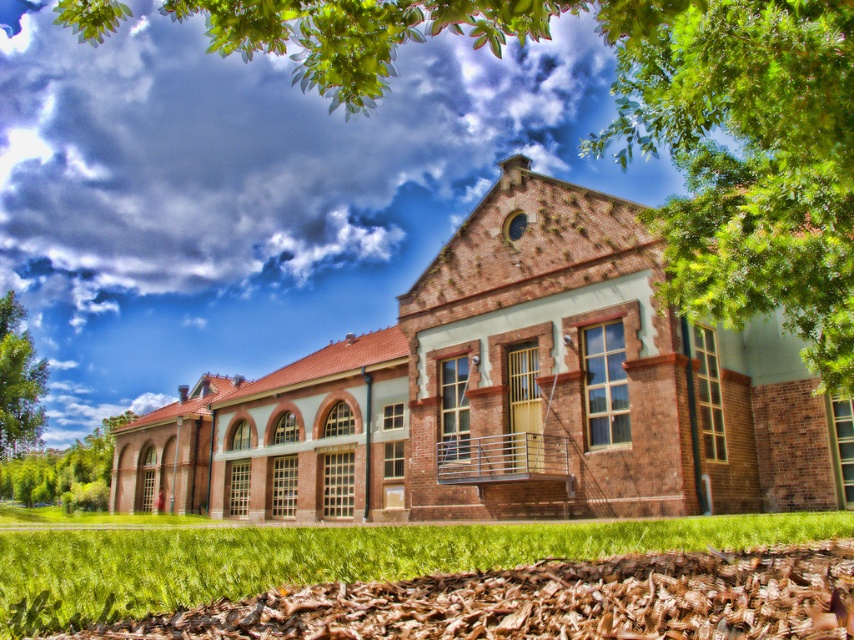
From the picture: You are a landscape architect designing a new garden layout. You need to place a 3m tall statue between the green leafy tree at upper center and the green leafy tree at lower left. Which tree should the statue be closer to in order to maintain visual balance?

The green leafy tree at upper center is much taller than the green leafy tree at lower left. To maintain visual balance, the statue should be placed closer to the shorter green leafy tree at lower left to compensate for the height difference.

You are a landscape architect designing a new garden layout. You have two green leafy trees to place in the garden. The green leafy tree at upper center and the green leafy tree at lower left. Based on their sizes, which tree should be placed closer to the historic building to create a balanced aesthetic?

The green leafy tree at upper center has a larger size compared to the green leafy tree at lower left, so placing the larger tree closer to the historic building would create a balanced aesthetic by emphasizing its grandeur against the building.